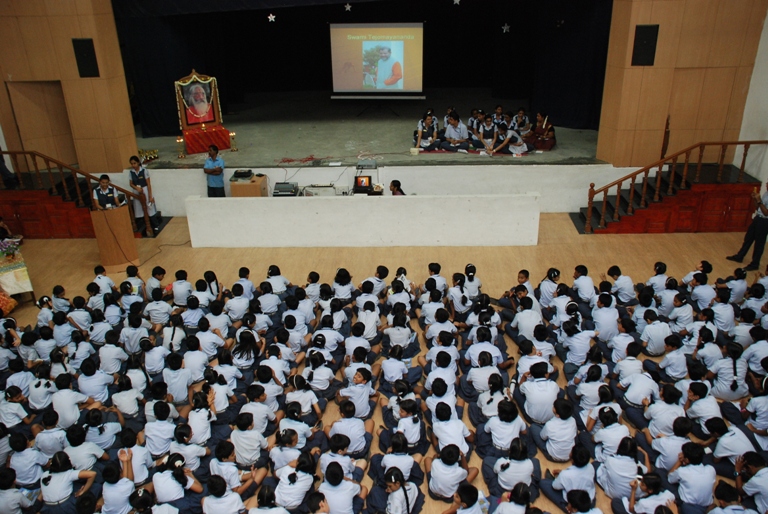
The image size is (768, 514). What are the coordinates of `screen` in the screenshot? It's located at (415, 50).